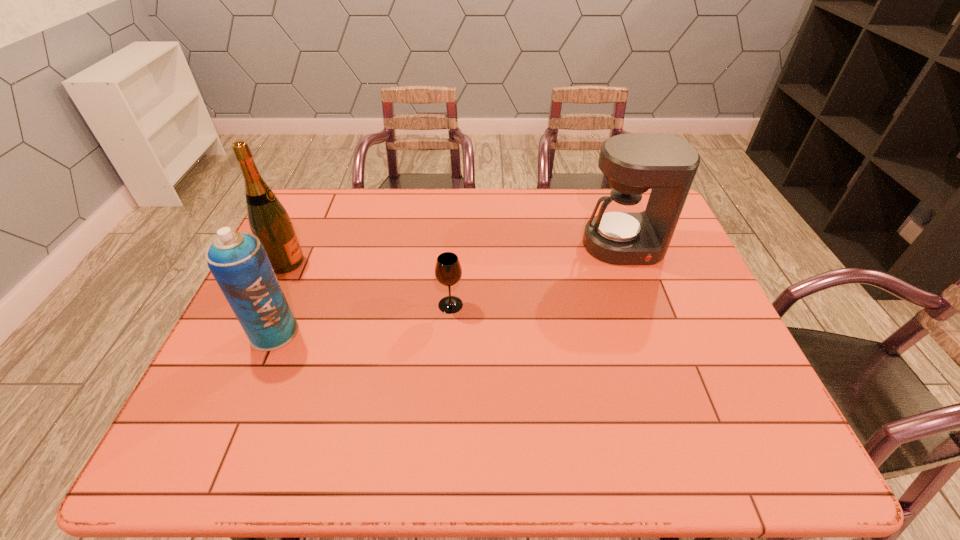
Locate an element on the screen. The image size is (960, 540). vacant space that satisfies the following two spatial constraints: 1. on the back side of the nearest object; 2. on the front-facing side of the tallest object is located at coordinates (304, 262).

Where is `blank space that satisfies the following two spatial constraints: 1. on the front-facing side of the wine bottle; 2. on the back side of the nearest object`? The width and height of the screenshot is (960, 540). blank space that satisfies the following two spatial constraints: 1. on the front-facing side of the wine bottle; 2. on the back side of the nearest object is located at coordinates (253, 333).

The image size is (960, 540). Find the location of `free spot that satisfies the following two spatial constraints: 1. on the front-facing side of the wine bottle; 2. on the back side of the wineglass`. free spot that satisfies the following two spatial constraints: 1. on the front-facing side of the wine bottle; 2. on the back side of the wineglass is located at coordinates (266, 305).

At what (x,y) coordinates should I click in order to perform the action: click on free space in the image that satisfies the following two spatial constraints: 1. on the back side of the shortest object; 2. on the front-facing side of the tallest object. Please return your answer as a coordinate pair (x, y). The width and height of the screenshot is (960, 540). Looking at the image, I should click on (453, 262).